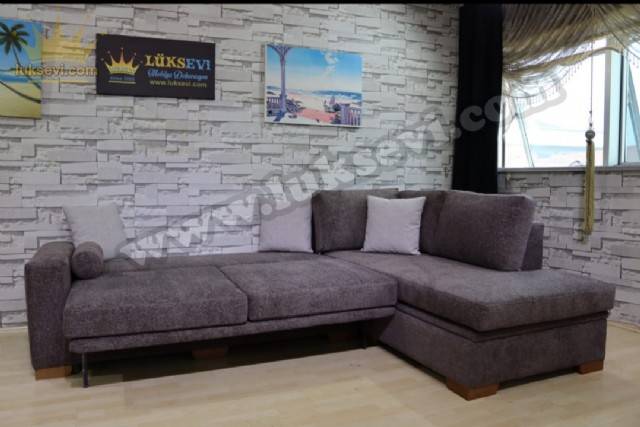
Locate an element on the screen. This screenshot has height=427, width=640. poster is located at coordinates (189, 81).